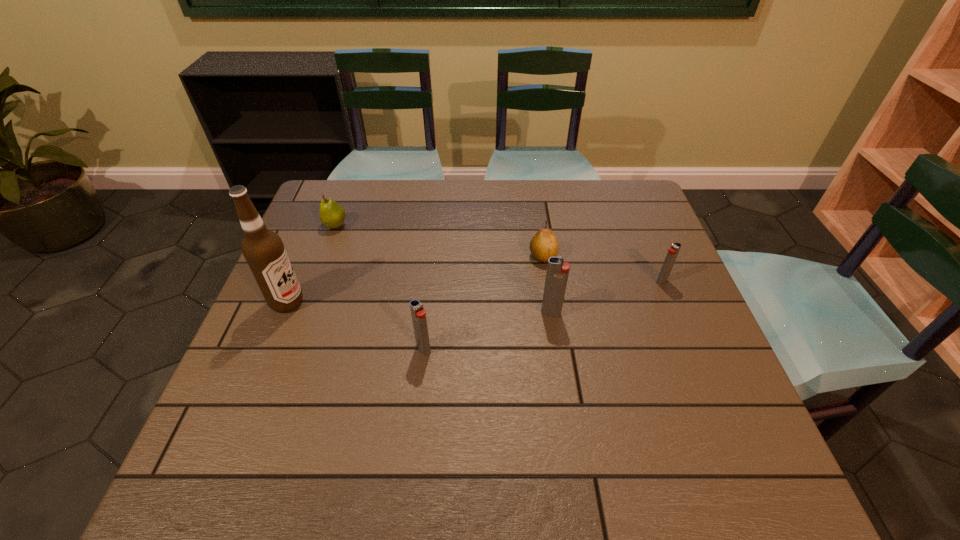
The width and height of the screenshot is (960, 540). Identify the location of the second tallest igniter. (418, 313).

At what (x,y) coordinates should I click in order to perform the action: click on the third tallest object. Please return your answer as a coordinate pair (x, y). This screenshot has height=540, width=960. Looking at the image, I should click on (418, 313).

In order to click on the second nearest igniter in this screenshot , I will do `click(557, 273)`.

The width and height of the screenshot is (960, 540). Find the location of `the rightmost igniter`. the rightmost igniter is located at coordinates (673, 251).

Locate an element on the screen. This screenshot has width=960, height=540. the farthest igniter is located at coordinates (673, 251).

At what (x,y) coordinates should I click in order to perform the action: click on the left pear. Please return your answer as a coordinate pair (x, y). The width and height of the screenshot is (960, 540). Looking at the image, I should click on (332, 215).

Image resolution: width=960 pixels, height=540 pixels. In order to click on the farther pear in this screenshot , I will do `click(332, 215)`.

Locate an element on the screen. This screenshot has width=960, height=540. the nearer pear is located at coordinates (544, 244).

At what (x,y) coordinates should I click in order to perform the action: click on the fifth nearest object. Please return your answer as a coordinate pair (x, y). Looking at the image, I should click on (544, 244).

This screenshot has width=960, height=540. Find the location of `alcohol`. alcohol is located at coordinates (263, 249).